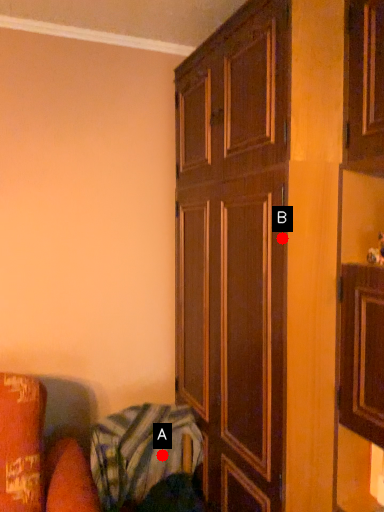
Question: Two points are circled on the image, labeled by A and B beside each circle. Which point is farther from the camera taking this photo?

Choices:
 (A) A is further
 (B) B is further

Answer: (A)